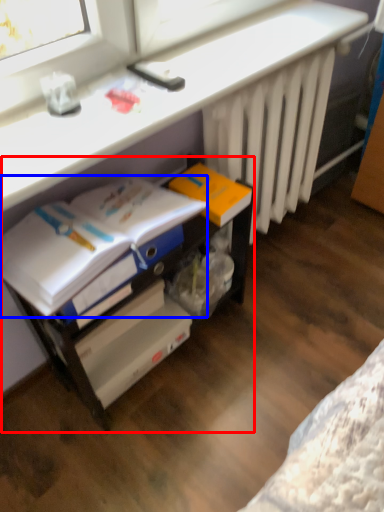
Question: Among these objects, which one is farthest to the camera, file cabinet (highlighted by a red box) or magazine (highlighted by a blue box)?

Choices:
 (A) file cabinet
 (B) magazine

Answer: (A)